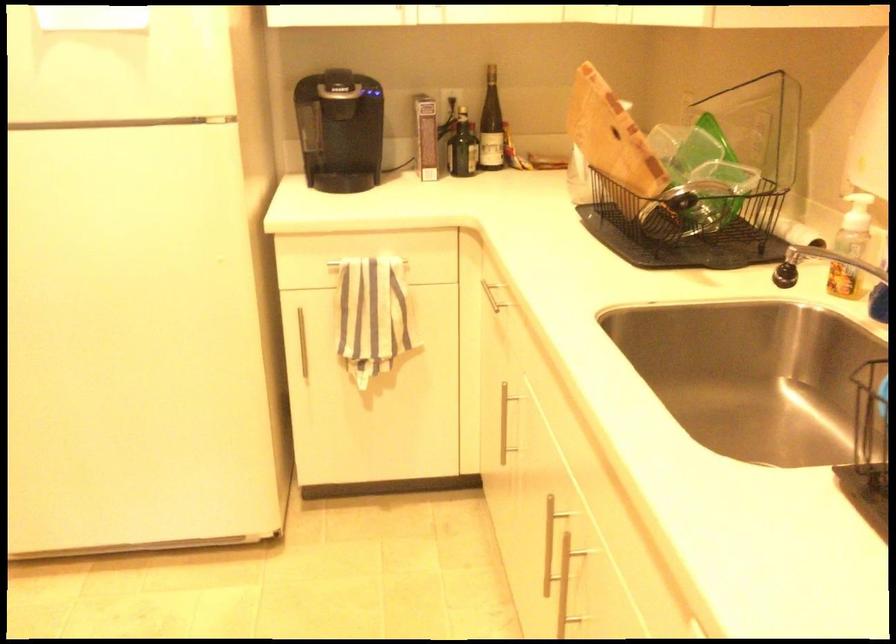
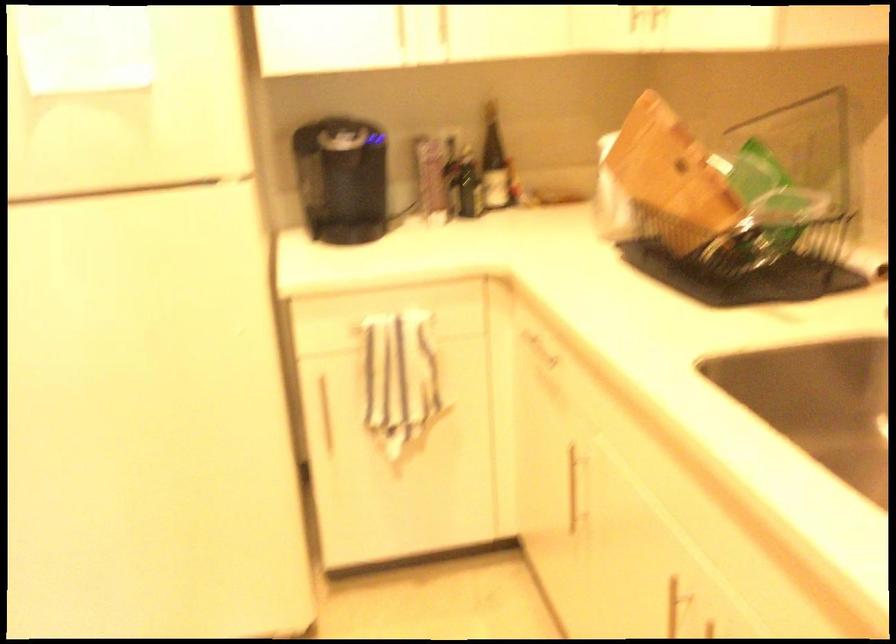
In the second image, find the point that corresponds to pixel 506 424 in the first image.

(576, 486)